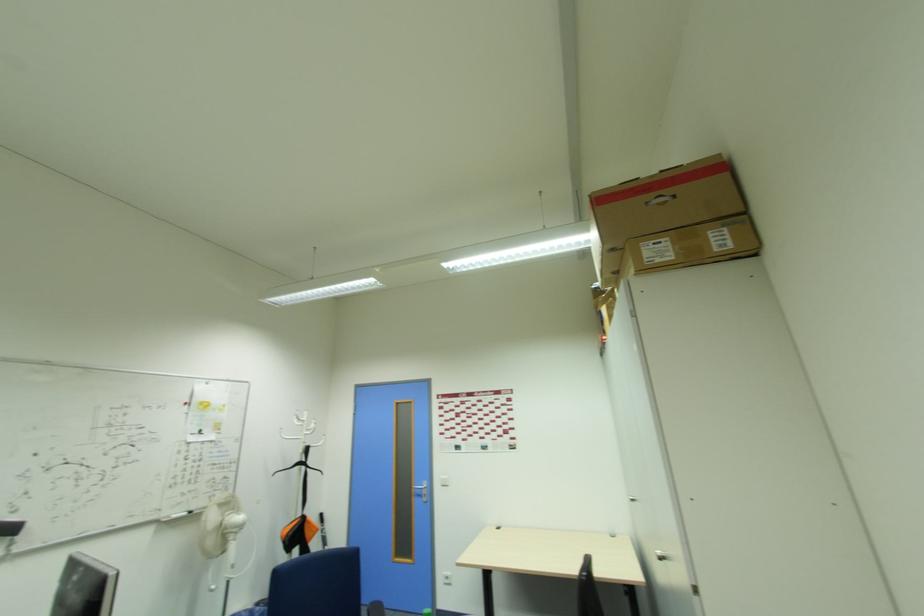
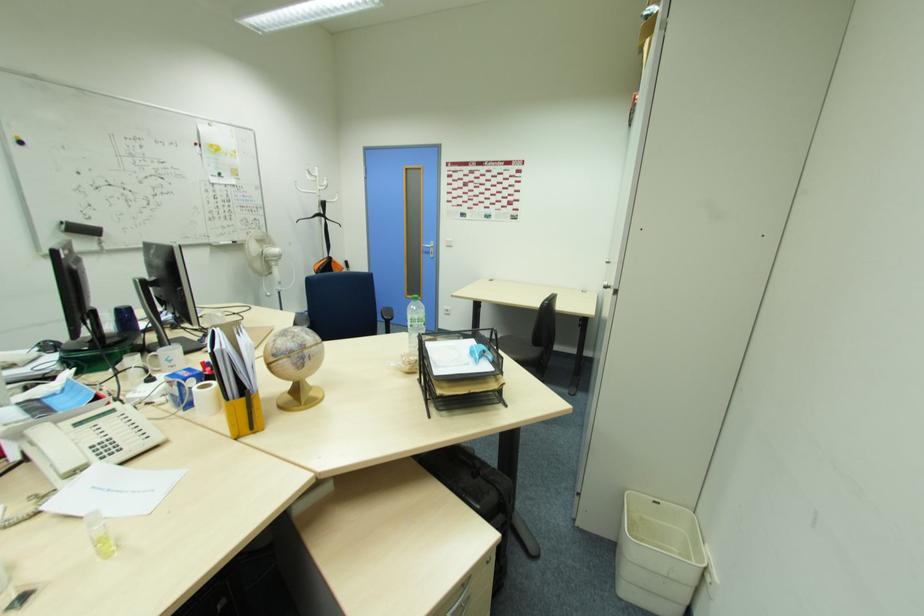
In the second image, find the point that corresponds to point (420, 493) in the first image.

(430, 252)